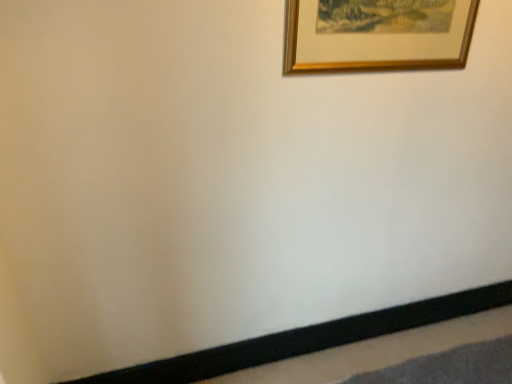
Identify the location of gold wooden picture frame at upper center. (375, 36).

Measure the distance between point (291, 18) and camera.

Point (291, 18) and camera are 4.39 feet apart.

Describe the element at coordinates (375, 36) in the screenshot. I see `gold wooden picture frame at upper center` at that location.

I want to click on gold wooden picture frame at upper center, so click(375, 36).